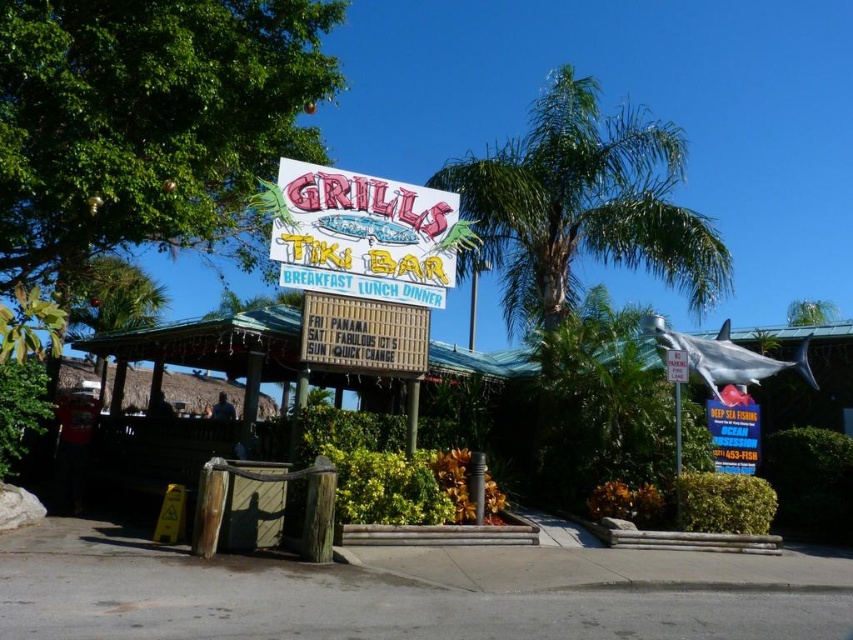
You are a customer entering the Grills Tiki Bar and see the white plastic signboard at center and the wooden sign at center. Which sign is taller?

The white plastic signboard at center is taller than the wooden sign at center.

You are a customer entering the Grills Tiki Bar and want to check the operating hours. The blue neon sign at upper right and white plastic sign at upper center are both visible. Which sign is bigger and where should you look to find the operating hours?

The blue neon sign at upper right is larger than the white plastic sign at upper center. The operating hours are listed on the white plastic sign at upper center as it contains the days of the week and special events.